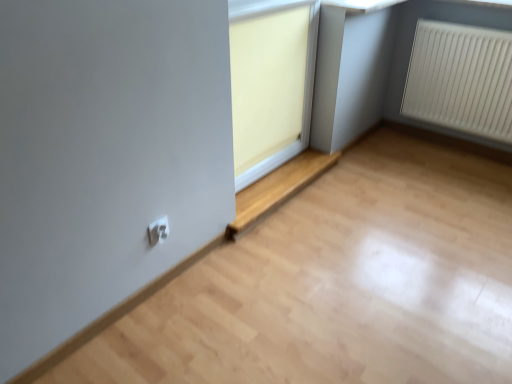
Question: Is white plastic electric outlet at lower center in contact with white plastic window frame at upper center?

Choices:
 (A) yes
 (B) no

Answer: (B)

Question: Is white plastic electric outlet at lower center turned away from white plastic window frame at upper center?

Choices:
 (A) no
 (B) yes

Answer: (A)

Question: Can you confirm if white plastic electric outlet at lower center is thinner than white plastic window frame at upper center?

Choices:
 (A) yes
 (B) no

Answer: (A)

Question: Considering the relative positions of white plastic electric outlet at lower center and white plastic window frame at upper center in the image provided, is white plastic electric outlet at lower center in front of white plastic window frame at upper center?

Choices:
 (A) no
 (B) yes

Answer: (B)

Question: Is white plastic electric outlet at lower center positioned behind white plastic window frame at upper center?

Choices:
 (A) yes
 (B) no

Answer: (B)

Question: Does white plastic electric outlet at lower center have a lesser height compared to white plastic window frame at upper center?

Choices:
 (A) no
 (B) yes

Answer: (B)

Question: Is white plastic radiator at right far from white plastic window frame at upper center?

Choices:
 (A) yes
 (B) no

Answer: (B)

Question: Does white plastic radiator at right appear on the right side of white plastic window frame at upper center?

Choices:
 (A) yes
 (B) no

Answer: (A)

Question: Is white plastic radiator at right closer to camera compared to white plastic window frame at upper center?

Choices:
 (A) no
 (B) yes

Answer: (A)

Question: Is white plastic radiator at right oriented towards white plastic window frame at upper center?

Choices:
 (A) no
 (B) yes

Answer: (B)

Question: From a real-world perspective, does white plastic radiator at right sit lower than white plastic window frame at upper center?

Choices:
 (A) no
 (B) yes

Answer: (B)

Question: Is white plastic radiator at right turned away from white plastic window frame at upper center?

Choices:
 (A) no
 (B) yes

Answer: (A)

Question: Considering the relative sizes of white plastic electric outlet at lower center and matte wood window at center in the image provided, is white plastic electric outlet at lower center shorter than matte wood window at center?

Choices:
 (A) no
 (B) yes

Answer: (B)